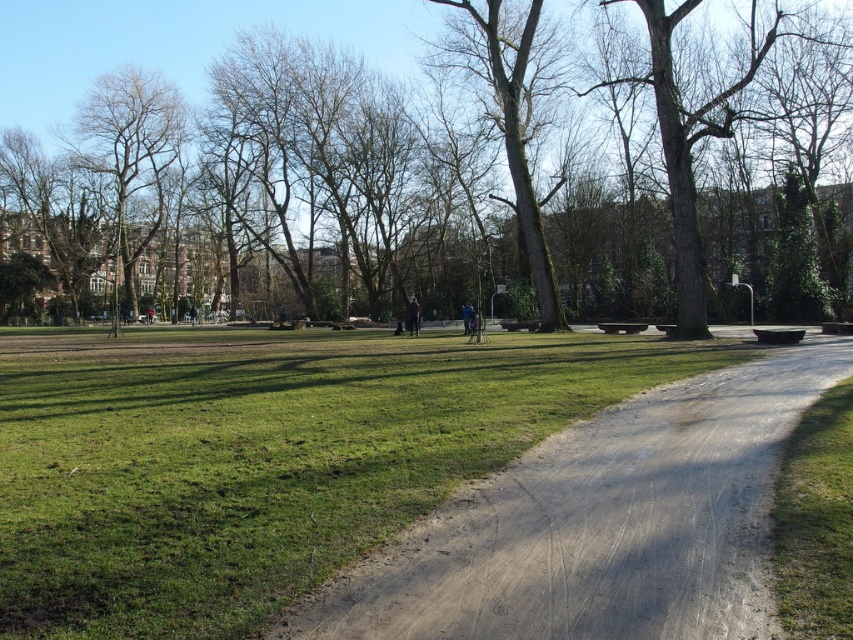
In the scene shown: Does dirt path at center have a greater width compared to green mossy bark tree at center?

Correct, the width of dirt path at center exceeds that of green mossy bark tree at center.

Between point (747, 413) and point (532, 218), which one is positioned in front?

Point (747, 413)

Is point (706, 593) positioned behind point (514, 157)?

No, it is not.

The image size is (853, 640). Find the location of `dirt path at center`. dirt path at center is located at coordinates (601, 524).

Between brown textured tree at center and green mossy bark tree at center, which one has more height?

brown textured tree at center is taller.

In the scene shown: Is brown textured tree at center above green mossy bark tree at center?

Yes, brown textured tree at center is above green mossy bark tree at center.

Who is more distant from viewer, (x=39, y=1) or (x=531, y=253)?

The point (x=39, y=1) is behind.

Image resolution: width=853 pixels, height=640 pixels. In order to click on brown textured tree at center in this screenshot , I will do `click(175, 42)`.

Does bare branches at upper left appear on the right side of green mossy bark tree at center?

No, bare branches at upper left is not to the right of green mossy bark tree at center.

Can you confirm if bare branches at upper left is thinner than green mossy bark tree at center?

No, bare branches at upper left is not thinner than green mossy bark tree at center.

The height and width of the screenshot is (640, 853). I want to click on bare branches at upper left, so click(131, 156).